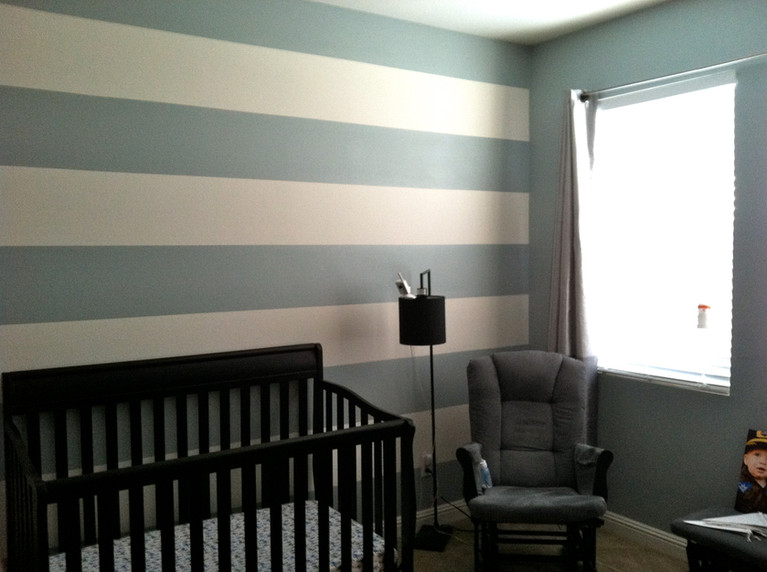
Locate an element on the screen. lamp stand is located at coordinates (432, 381).